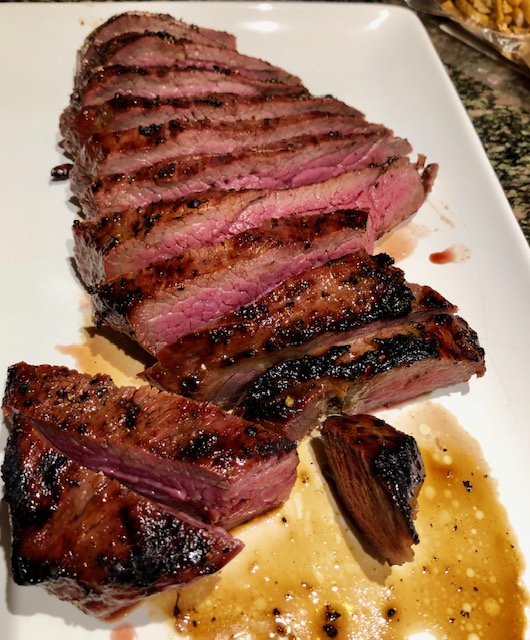
Where is `counter`? The height and width of the screenshot is (640, 530). counter is located at coordinates (506, 148).